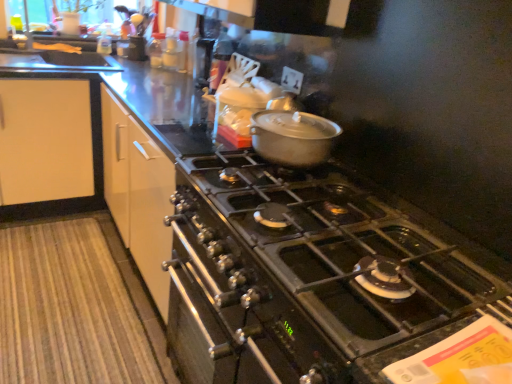
Question: Should I look upward or downward to see black stainless steel oven at center?

Choices:
 (A) down
 (B) up

Answer: (A)

Question: Considering the relative sizes of matte silver pot at center and yellow matte bread at upper left in the image provided, is matte silver pot at center wider than yellow matte bread at upper left?

Choices:
 (A) yes
 (B) no

Answer: (A)

Question: Considering the relative positions of matte silver pot at center and yellow matte bread at upper left in the image provided, is matte silver pot at center behind yellow matte bread at upper left?

Choices:
 (A) no
 (B) yes

Answer: (A)

Question: Could yellow matte bread at upper left be considered to be inside matte silver pot at center?

Choices:
 (A) no
 (B) yes

Answer: (A)

Question: Is matte silver pot at center touching yellow matte bread at upper left?

Choices:
 (A) yes
 (B) no

Answer: (B)

Question: From the image's perspective, is matte silver pot at center located beneath yellow matte bread at upper left?

Choices:
 (A) no
 (B) yes

Answer: (B)

Question: From a real-world perspective, is matte silver pot at center positioned over yellow matte bread at upper left based on gravity?

Choices:
 (A) yes
 (B) no

Answer: (A)

Question: Does black matte gas stove at center have a smaller size compared to black stainless steel oven at center?

Choices:
 (A) yes
 (B) no

Answer: (A)

Question: Is black matte gas stove at center thinner than black stainless steel oven at center?

Choices:
 (A) yes
 (B) no

Answer: (B)

Question: Does black matte gas stove at center lie behind black stainless steel oven at center?

Choices:
 (A) no
 (B) yes

Answer: (A)

Question: Are black matte gas stove at center and black stainless steel oven at center located far from each other?

Choices:
 (A) no
 (B) yes

Answer: (A)

Question: From a real-world perspective, is black matte gas stove at center over black stainless steel oven at center?

Choices:
 (A) yes
 (B) no

Answer: (A)

Question: Is black matte gas stove at center located outside black stainless steel oven at center?

Choices:
 (A) no
 (B) yes

Answer: (B)

Question: From a real-world perspective, does yellow matte bread at upper left sit lower than matte silver pot at center?

Choices:
 (A) yes
 (B) no

Answer: (A)